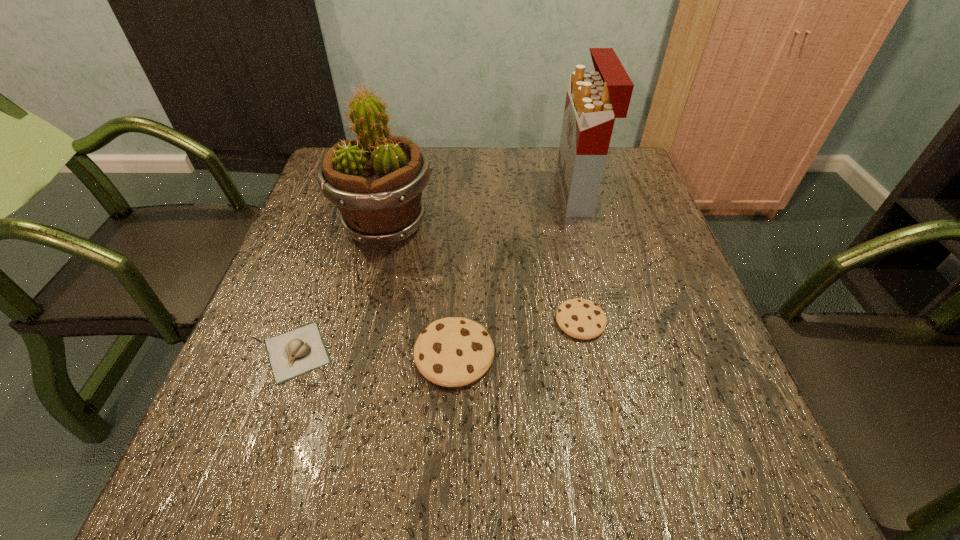
Identify the location of the left cookie. The image size is (960, 540). (452, 352).

You are a GUI agent. You are given a task and a screenshot of the screen. Output one action in this format:
    pyautogui.click(x=<x>, y=<y>)
    Task: Click on the taller cookie
    The image size is (960, 540).
    Given the screenshot: What is the action you would take?
    pyautogui.click(x=452, y=352)

The width and height of the screenshot is (960, 540). I want to click on the right cookie, so click(x=579, y=318).

This screenshot has height=540, width=960. What are the coordinates of `the second shortest object` in the screenshot? It's located at (579, 318).

Identify the location of flowerpot. (376, 180).

Locate an element on the screen. The height and width of the screenshot is (540, 960). the shortest object is located at coordinates [296, 352].

Locate an element on the screen. The image size is (960, 540). cigarette case is located at coordinates (594, 99).

Locate an element on the screen. The height and width of the screenshot is (540, 960). free space located 0.280m on the left of the taller cookie is located at coordinates (266, 355).

Locate an element on the screen. The height and width of the screenshot is (540, 960). free location located on the left of the second shortest object is located at coordinates (401, 321).

Where is `vacant area situated 0.280m on the front of the flowerpot`? The width and height of the screenshot is (960, 540). vacant area situated 0.280m on the front of the flowerpot is located at coordinates (353, 364).